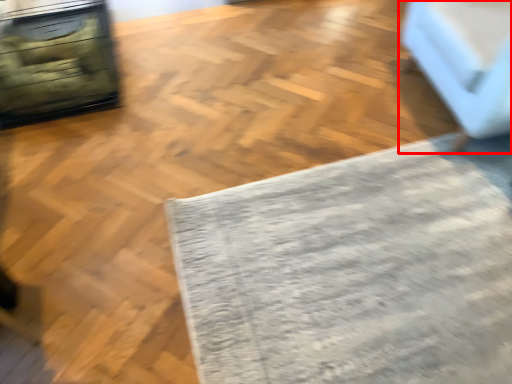
Question: From the image's perspective, what is the correct spatial positioning of furniture (annotated by the red box) in reference to mat?

Choices:
 (A) below
 (B) above

Answer: (B)